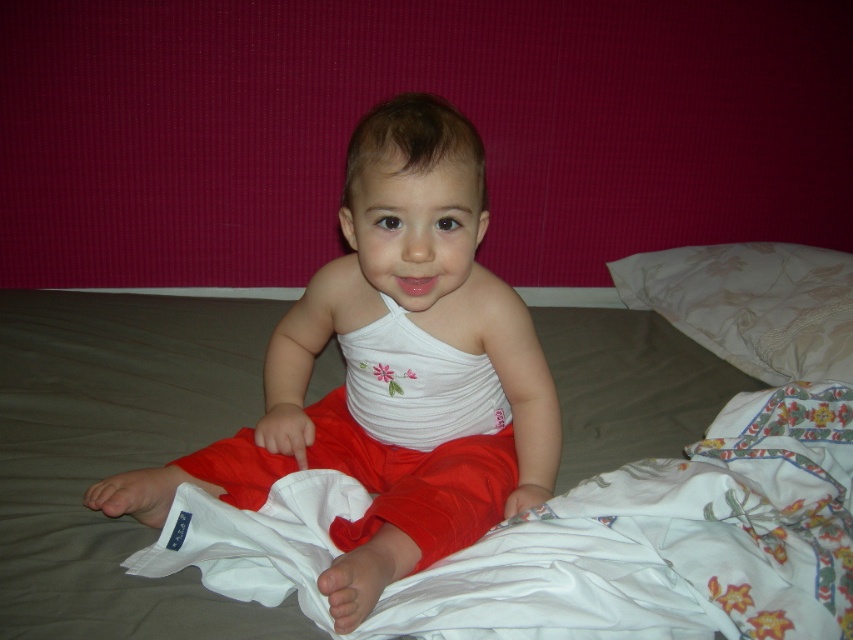
You are a parent trying to decide whether to use the white fabric bed at center and the white textured pillow at upper right for your child. Based on their sizes, which one would be more suitable for covering the child during nap time?

The white fabric bed at center is larger in size than the white textured pillow at upper right, so it would be more suitable for covering the child during nap time.

You are a parent trying to decide which item to wash first. You need to know which one is taller between the white soft fabric at center and the white fabric bed at center. Can you tell me which one is taller?

The white soft fabric at center is much taller than the white fabric bed at center according to the description.

In the scene, there is a child sitting on a bed with two items. The items are the white soft fabric at center and the white textured pillow at upper right. Which item is positioned to the left of the other?

The white soft fabric at center is to the left of the white textured pillow at upper right.